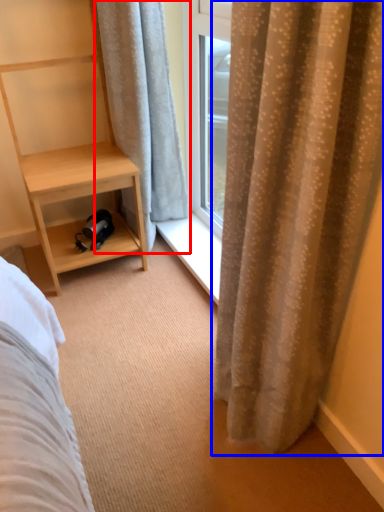
Question: Among these objects, which one is nearest to the camera, curtain (highlighted by a red box) or curtain (highlighted by a blue box)?

Choices:
 (A) curtain
 (B) curtain

Answer: (B)